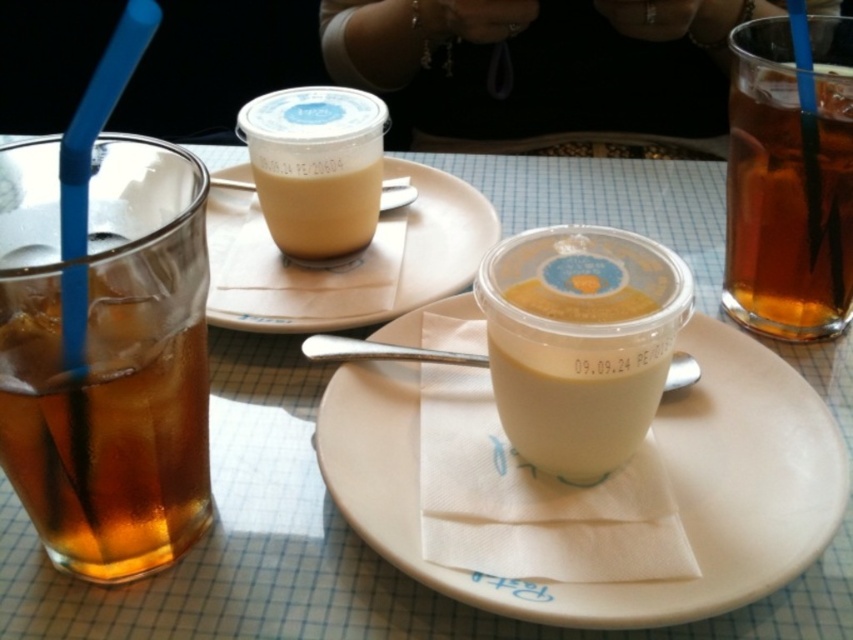
Question: Which object is the farthest from the brown translucent glass at left?

Choices:
 (A) brown translucent glass at right
 (B) translucent plastic cup at center

Answer: (A)

Question: Estimate the real-world distances between objects in this image. Which object is closer to the brown translucent glass at left?

Choices:
 (A) white ceramic plate at center
 (B) matte plastic cup at center

Answer: (B)

Question: Is brown translucent glass at left to the left of brown translucent glass at right from the viewer's perspective?

Choices:
 (A) no
 (B) yes

Answer: (B)

Question: Which of the following is the farthest from the observer?

Choices:
 (A) brown translucent glass at right
 (B) matte plastic cup at center

Answer: (A)

Question: Does matte plastic cup at center have a lesser width compared to matte plastic cup at upper center?

Choices:
 (A) yes
 (B) no

Answer: (A)

Question: Does matte plastic cup at center appear over brown translucent glass at right?

Choices:
 (A) no
 (B) yes

Answer: (A)